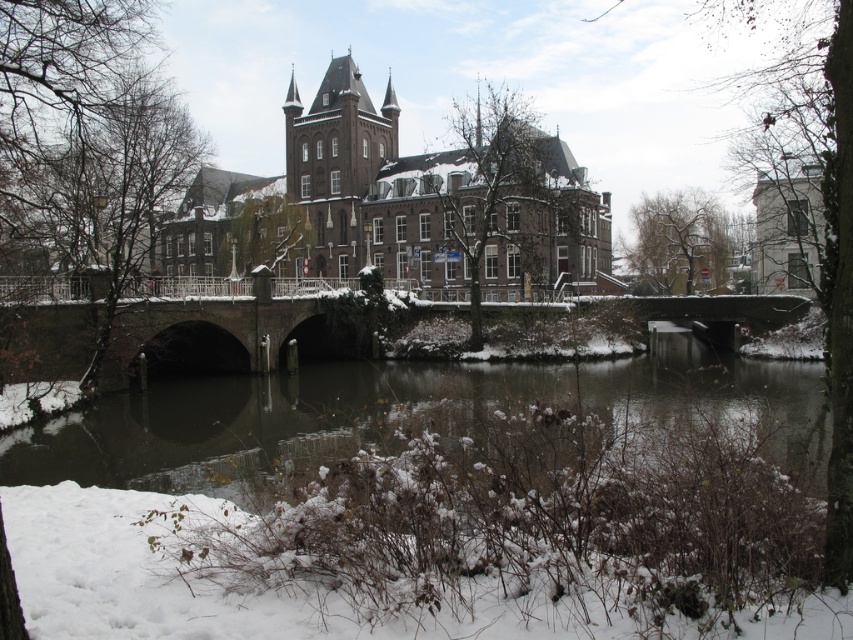
Question: Is snowy brown water at lower center to the right of concrete stone bridge at center from the viewer's perspective?

Choices:
 (A) yes
 (B) no

Answer: (A)

Question: Which point is farther from the camera taking this photo?

Choices:
 (A) (346, 74)
 (B) (62, 285)

Answer: (A)

Question: Does concrete stone bridge at center come in front of dark brown stone tower at center?

Choices:
 (A) no
 (B) yes

Answer: (B)

Question: Estimate the real-world distances between objects in this image. Which object is farther from the snowy brown water at lower center?

Choices:
 (A) concrete stone bridge at center
 (B) dark brown stone tower at center

Answer: (B)

Question: Which object appears closest to the camera in this image?

Choices:
 (A) dark brown stone tower at center
 (B) concrete stone bridge at center
 (C) snowy brown water at lower center

Answer: (C)

Question: Is concrete stone bridge at center positioned behind dark brown stone tower at center?

Choices:
 (A) no
 (B) yes

Answer: (A)